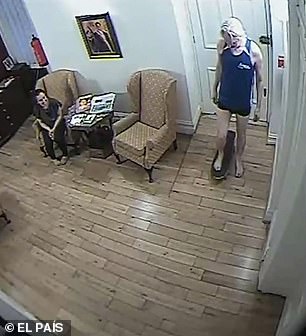
Locate an element on the screen. This screenshot has width=306, height=336. fire extinguisher is located at coordinates (36, 52).